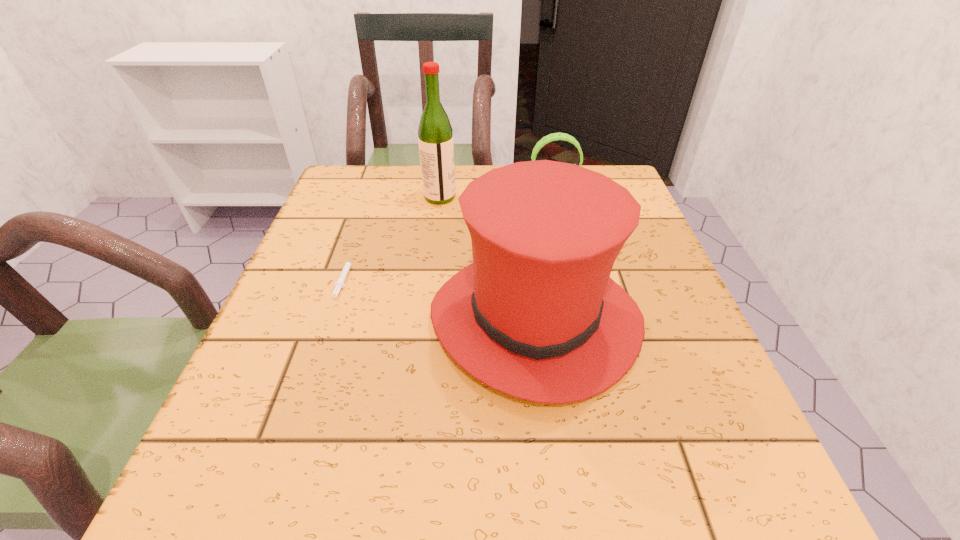
Where is `the tallest object`? The image size is (960, 540). the tallest object is located at coordinates (435, 135).

The width and height of the screenshot is (960, 540). Identify the location of the third shortest object. (536, 316).

The height and width of the screenshot is (540, 960). In order to click on the third tallest object in this screenshot , I will do `click(553, 137)`.

I want to click on the shortest object, so click(339, 284).

Locate an element on the screen. The width and height of the screenshot is (960, 540). the leftmost object is located at coordinates (x=339, y=284).

Locate an element on the screen. The image size is (960, 540). free location located 0.240m on the label of the liquor is located at coordinates (555, 197).

What are the coordinates of `vacant space located 0.190m on the back of the hat` in the screenshot? It's located at (520, 204).

Locate an element on the screen. This screenshot has height=540, width=960. vacant space situated on the right of the third tallest object is located at coordinates (617, 192).

This screenshot has height=540, width=960. What are the coordinates of `vacant space located 0.080m on the back of the leftmost object` in the screenshot? It's located at (359, 233).

Find the location of `liquor at the far edge`. liquor at the far edge is located at coordinates (435, 135).